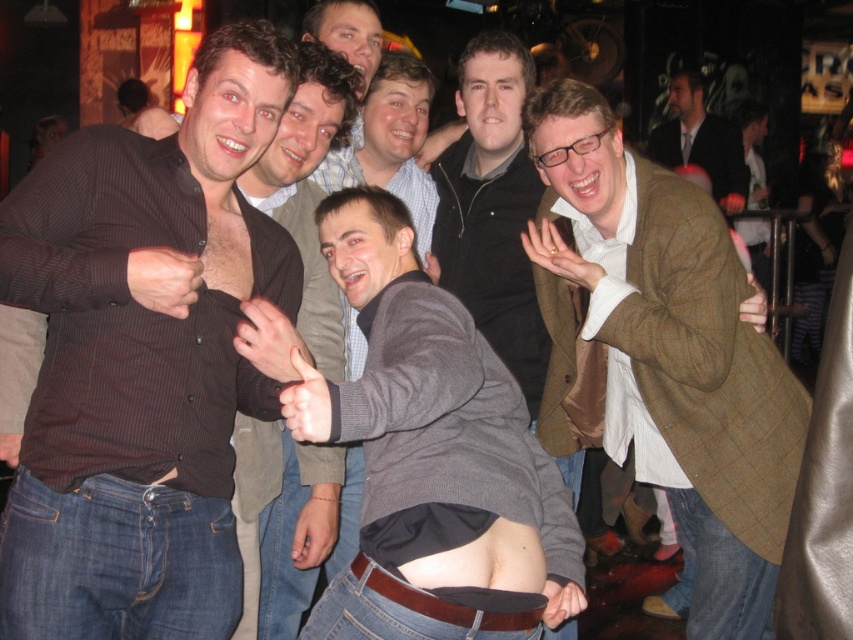
Looking at this image, you are a photographer trying to capture a closeup of the smaller brown woolen blazer. Which one should you focus on between the brown woolen blazer at right and the brown woolen blazer at upper right?

The brown woolen blazer at right is smaller in size compared to the brown woolen blazer at upper right, so you should focus on the brown woolen blazer at right to capture the smaller one.

You are standing in the same room as the group of men. There are two points marked in the image. One is at coordinate point (160, 621) and the other is at coordinate point (675, 102). Which point is closer to you?

Point (160, 621) is in front of point (675, 102), so it is closer to you.